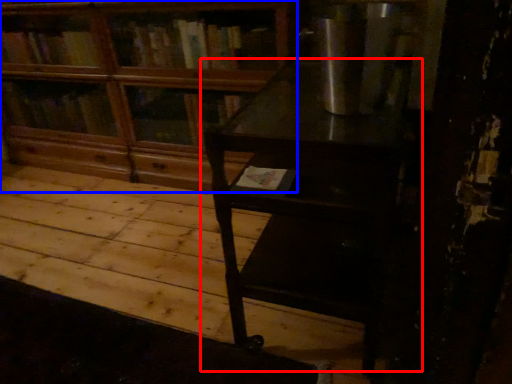
Question: Among these objects, which one is farthest to the camera, table (highlighted by a red box) or bookcase (highlighted by a blue box)?

Choices:
 (A) table
 (B) bookcase

Answer: (B)